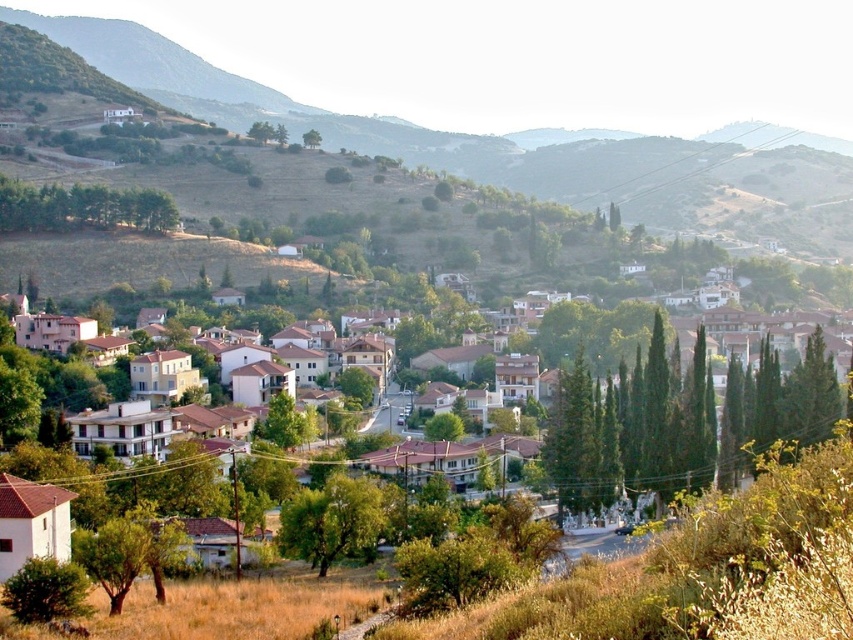
Question: Can you confirm if green textured trees at center is positioned to the right of green leafy trees at upper left?

Choices:
 (A) no
 (B) yes

Answer: (B)

Question: Is green textured trees at center closer to the viewer compared to green leafy tree at center?

Choices:
 (A) yes
 (B) no

Answer: (B)

Question: Which point is closer to the camera?

Choices:
 (A) coord(61,209)
 (B) coord(126,81)

Answer: (A)

Question: Which object is the closest to the green leafy tree at center?

Choices:
 (A) green textured trees at center
 (B) green leafy tree at upper center
 (C) green leafy trees at upper left
 (D) green grassy hillside at upper left

Answer: (A)

Question: Does green grassy hillside at upper left appear over green textured trees at center?

Choices:
 (A) no
 (B) yes

Answer: (B)

Question: Estimate the real-world distances between objects in this image. Which object is farther from the green grassy hillside at upper left?

Choices:
 (A) green leafy trees at upper left
 (B) green leafy tree at center
 (C) green textured trees at center
 (D) green leafy tree at upper center

Answer: (B)